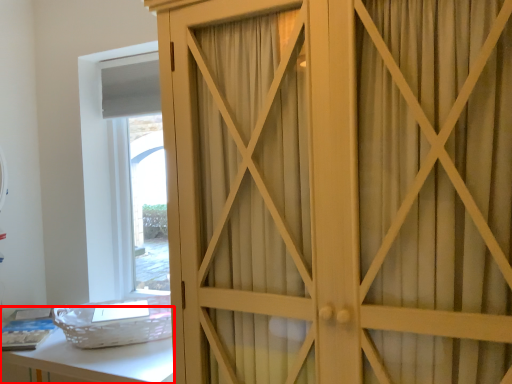
Question: Observing the image, what is the correct spatial positioning of vanity (annotated by the red box) in reference to cupboard?

Choices:
 (A) right
 (B) left

Answer: (B)